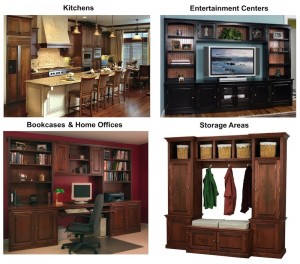
The image size is (300, 264). Find the location of `stove`. stove is located at coordinates (56, 71).